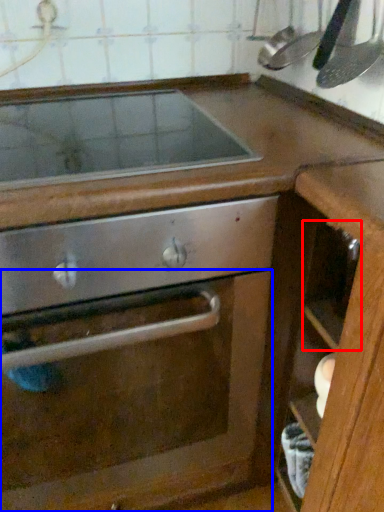
Question: Which point is further to the camera, drawer (highlighted by a red box) or glass door (highlighted by a blue box)?

Choices:
 (A) drawer
 (B) glass door

Answer: (A)